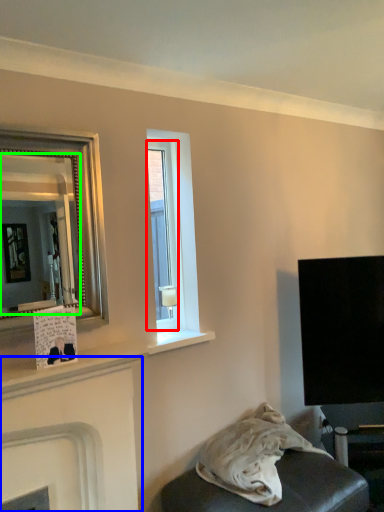
Question: Which object is positioned farthest from window (highlighted by a red box)? Select from fireplace (highlighted by a blue box) and mirror (highlighted by a green box).

Choices:
 (A) fireplace
 (B) mirror

Answer: (B)